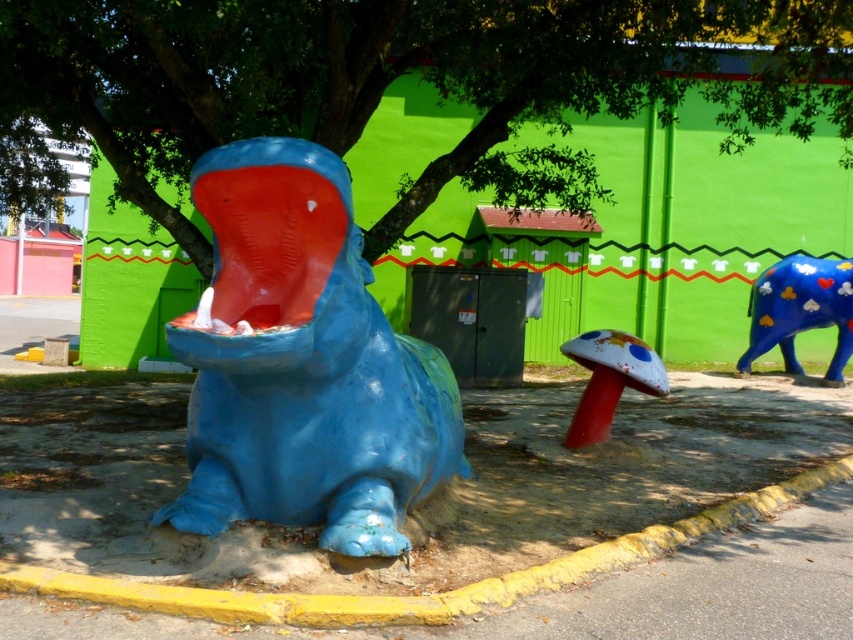
Is point (397, 621) positioned after point (836, 317)?

No, (397, 621) is in front of (836, 317).

The height and width of the screenshot is (640, 853). Find the location of `yellow painted curb at lower left`. yellow painted curb at lower left is located at coordinates (422, 595).

Does green leafy tree at upper center come in front of blue glossy hippo at center?

No, green leafy tree at upper center is behind blue glossy hippo at center.

Does green leafy tree at upper center appear under blue glossy hippo at center?

Incorrect, green leafy tree at upper center is not positioned below blue glossy hippo at center.

Who is more forward, [340,115] or [387,344]?

Point [387,344] is in front.

In order to click on green leafy tree at upper center in this screenshot , I will do `click(405, 74)`.

Locate an element on the screen. The height and width of the screenshot is (640, 853). green leafy tree at upper center is located at coordinates (405, 74).